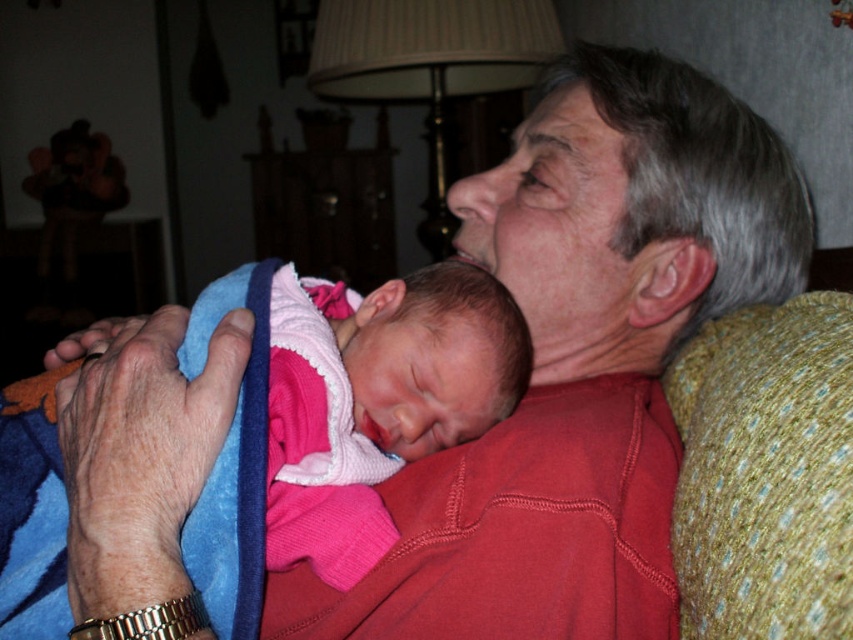
You are an artist sketching the scene and want to add details about the gray hair at upper right. Where exactly should you place it in your drawing?

You should place the gray hair at upper right at point 0.333 on the x axis and 0.744 on the y axis.

You are a photographer trying to capture a closeup shot of the gray hair at upper right and the pink fleece blanket at center. Which object should you zoom in on to ensure it fills the frame more, considering their sizes?

The gray hair at upper right has a larger size compared to the pink fleece blanket at center, so you should zoom in on the gray hair at upper right to ensure it fills the frame more.